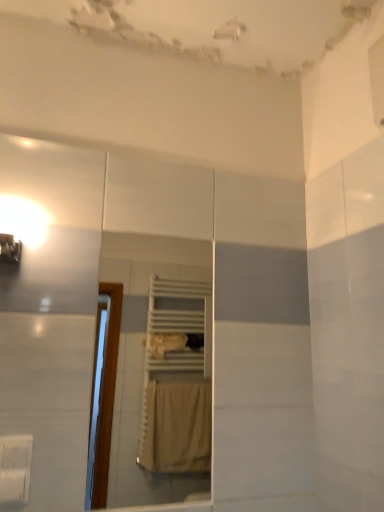
Image resolution: width=384 pixels, height=512 pixels. Identify the location of white glossy mirror at center. (143, 356).

Image resolution: width=384 pixels, height=512 pixels. What do you see at coordinates (143, 356) in the screenshot?
I see `white glossy mirror at center` at bounding box center [143, 356].

Locate an element on the screen. white glossy mirror at center is located at coordinates (143, 356).